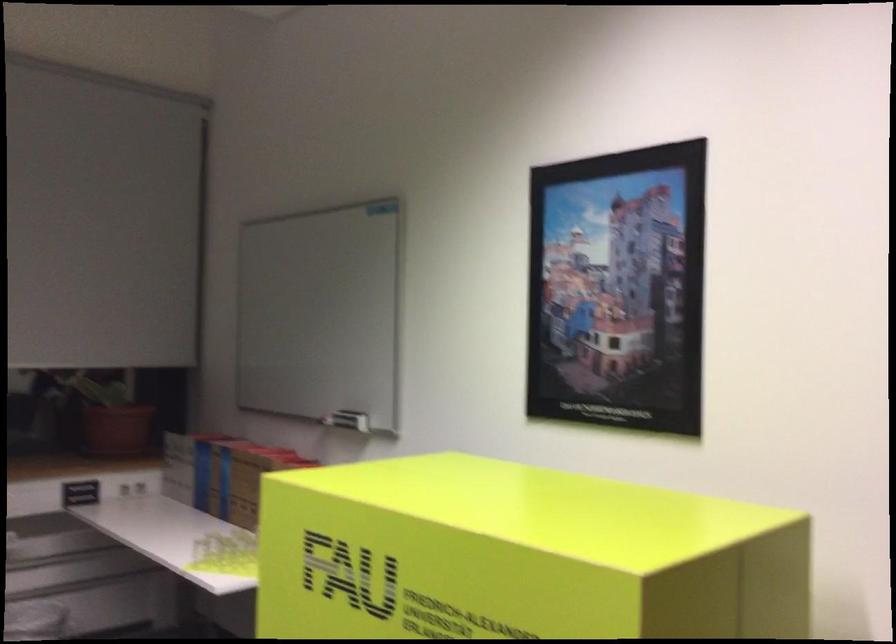
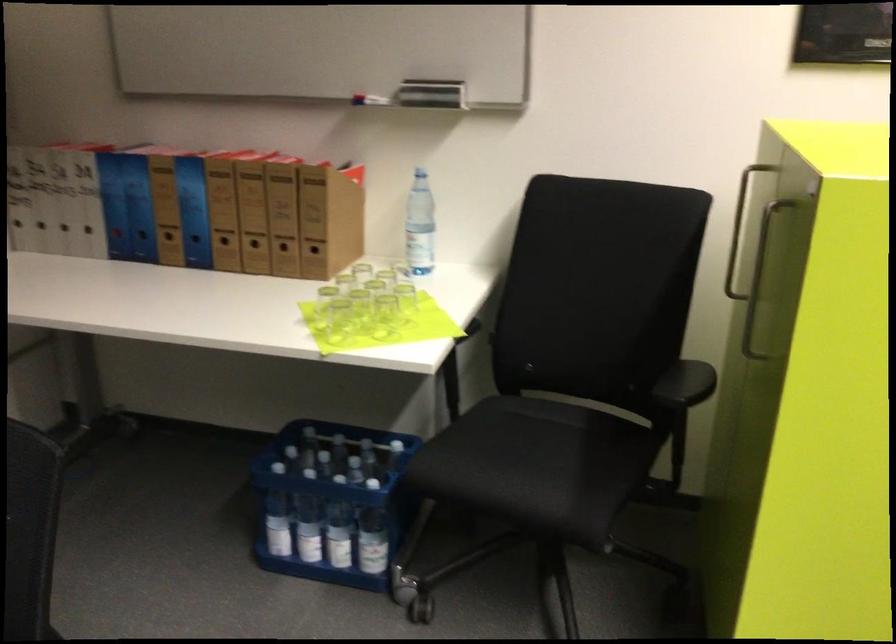
Where in the second image is the point corresponding to (x=238, y=502) from the first image?

(225, 245)